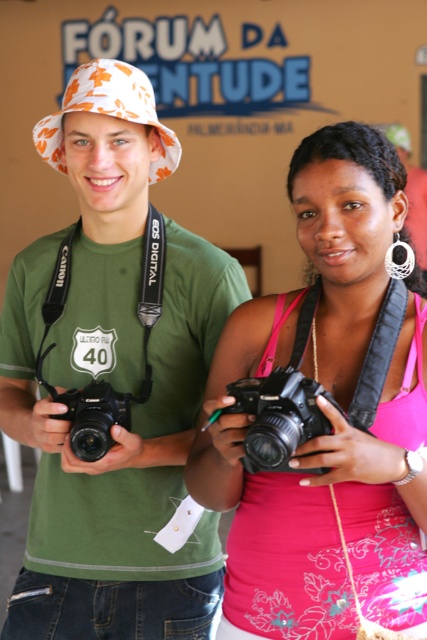
Question: Which point appears farthest from the camera in this image?

Choices:
 (A) (239, 404)
 (B) (228, 560)
 (C) (102, 426)
 (D) (34, 426)

Answer: (D)

Question: Is matte green t-shirt at center closer to the viewer compared to black plastic camera at center?

Choices:
 (A) yes
 (B) no

Answer: (B)

Question: Does black plastic camera at center appear under matte black camera at center?

Choices:
 (A) no
 (B) yes

Answer: (A)

Question: Based on their relative distances, which object is nearer to the matte black camera at center?

Choices:
 (A) black plastic camera at center
 (B) matte green t-shirt at center
 (C) pink fabric tank top at center

Answer: (B)

Question: Is the position of pink fabric tank top at center more distant than that of black plastic camera at center?

Choices:
 (A) no
 (B) yes

Answer: (B)

Question: Which object appears farthest from the camera in this image?

Choices:
 (A) black plastic camera at center
 (B) matte green t-shirt at center
 (C) matte black camera at center
 (D) pink fabric tank top at center

Answer: (B)